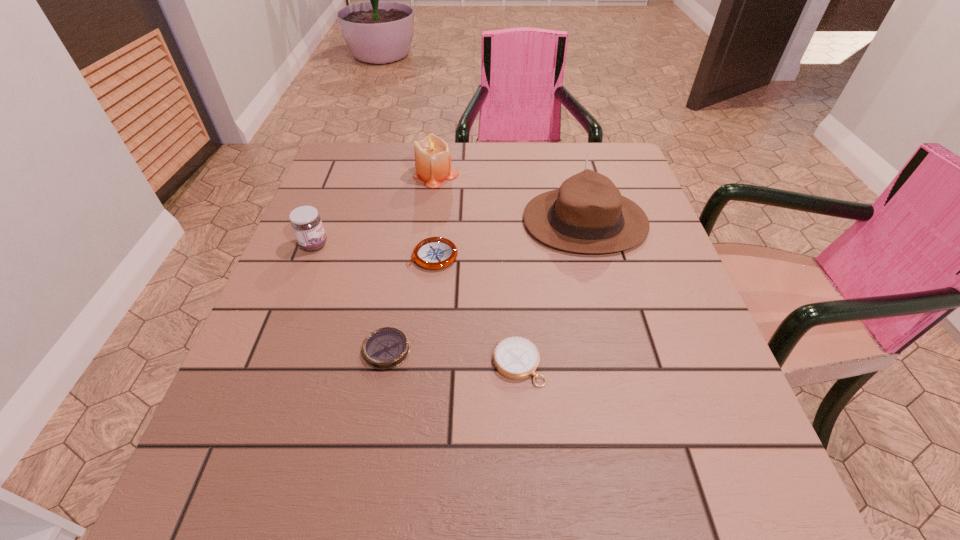
Identify which compass is located as the second nearest to the fedora. Please provide its 2D coordinates. Your answer should be formatted as a tuple, i.e. [(x, y)], where the tuple contains the x and y coordinates of a point satisfying the conditions above.

[(517, 358)]

The width and height of the screenshot is (960, 540). I want to click on free location that satisfies the following two spatial constraints: 1. on the front label of the jam; 2. on the left side of the third shortest object, so click(x=310, y=256).

This screenshot has width=960, height=540. Find the location of `free space that satisfies the following two spatial constraints: 1. on the front side of the rightmost compass; 2. on the right side of the candle`. free space that satisfies the following two spatial constraints: 1. on the front side of the rightmost compass; 2. on the right side of the candle is located at coordinates (413, 364).

Find the location of a particular element. This screenshot has width=960, height=540. blank space that satisfies the following two spatial constraints: 1. on the front label of the tallest compass; 2. on the left side of the jam is located at coordinates (310, 256).

The height and width of the screenshot is (540, 960). In order to click on free space in the image that satisfies the following two spatial constraints: 1. on the back side of the farthest object; 2. on the right side of the shortest object in this screenshot , I will do `click(418, 174)`.

At what (x,y) coordinates should I click in order to perform the action: click on free spot that satisfies the following two spatial constraints: 1. on the front label of the leftmost object; 2. on the right side of the farthest compass. Please return your answer as a coordinate pair (x, y). Looking at the image, I should click on (310, 256).

I want to click on free space in the image that satisfies the following two spatial constraints: 1. on the front label of the rightmost compass; 2. on the left side of the leftmost object, so click(268, 364).